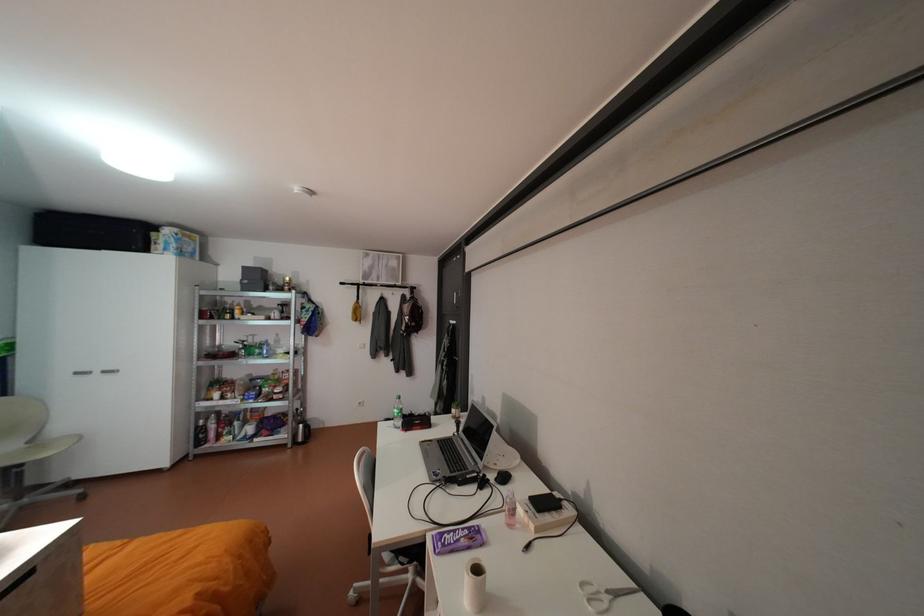
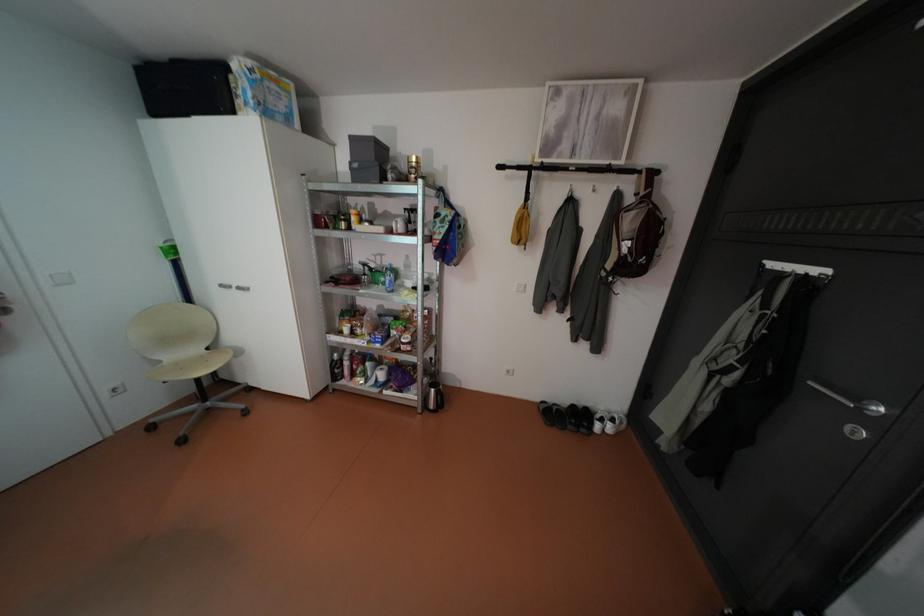
Locate, in the second image, the point that corresponds to pixel 199 248 in the first image.

(290, 107)